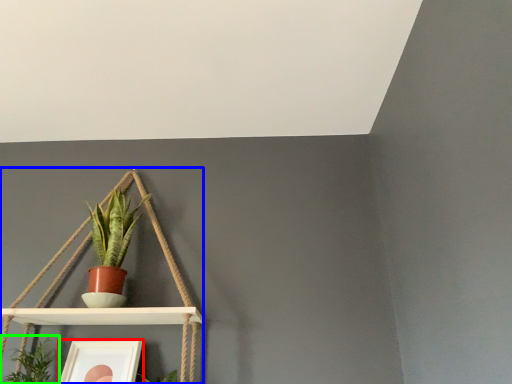
Question: Considering the real-world distances, which object is closest to picture frame (highlighted by a red box)? shelf (highlighted by a blue box) or houseplant (highlighted by a green box).

Choices:
 (A) shelf
 (B) houseplant

Answer: (B)